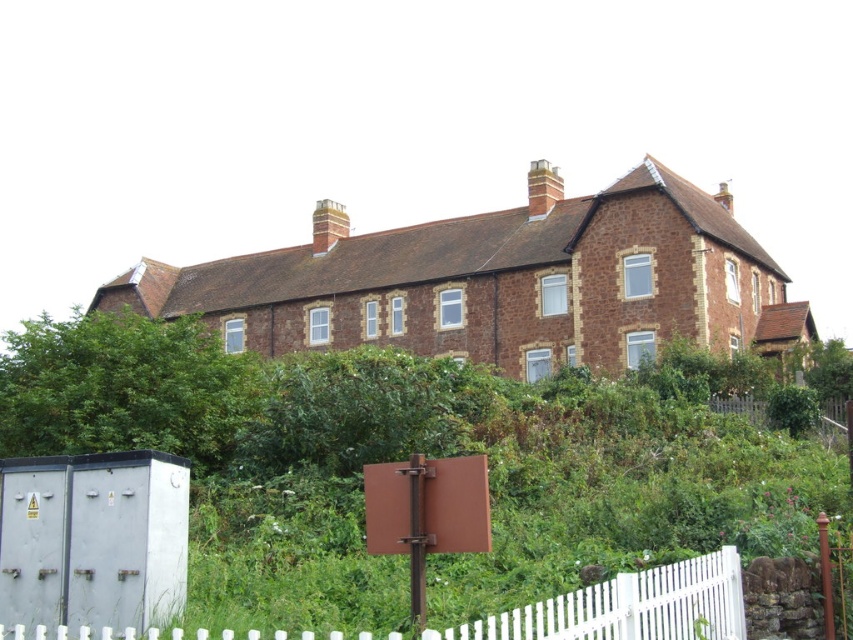
Question: Is green leafy vegetation at center further to camera compared to white picket fence at lower right?

Choices:
 (A) yes
 (B) no

Answer: (A)

Question: Which point appears closest to the camera in this image?

Choices:
 (A) (759, 467)
 (B) (587, 596)

Answer: (B)

Question: Can you confirm if green leafy vegetation at center is wider than white picket fence at lower right?

Choices:
 (A) yes
 (B) no

Answer: (A)

Question: Does green leafy vegetation at center have a larger size compared to white picket fence at lower right?

Choices:
 (A) no
 (B) yes

Answer: (B)

Question: Which point is closer to the camera taking this photo?

Choices:
 (A) (543, 403)
 (B) (692, 605)

Answer: (B)